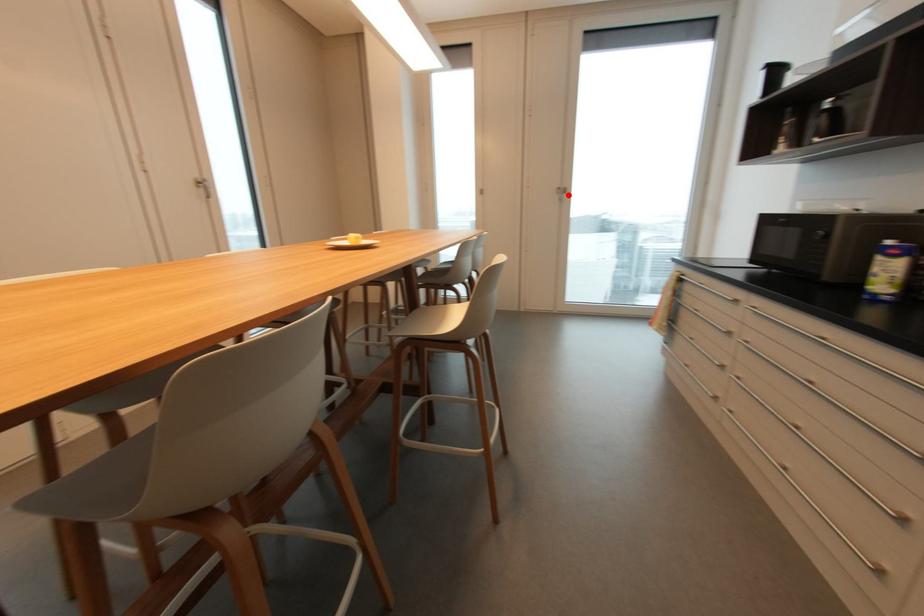
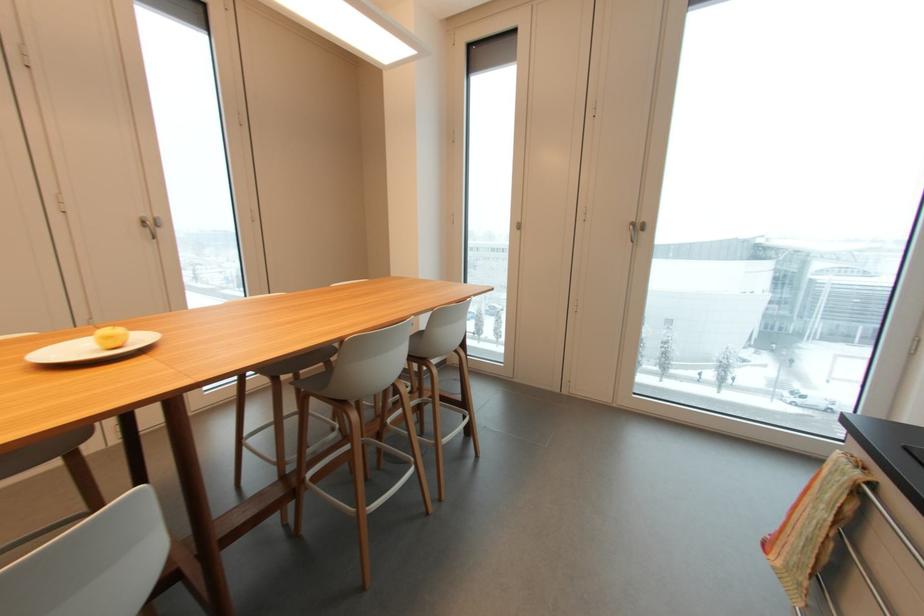
Find the pixel in the second image that matches the highlighted location in the first image.

(643, 233)